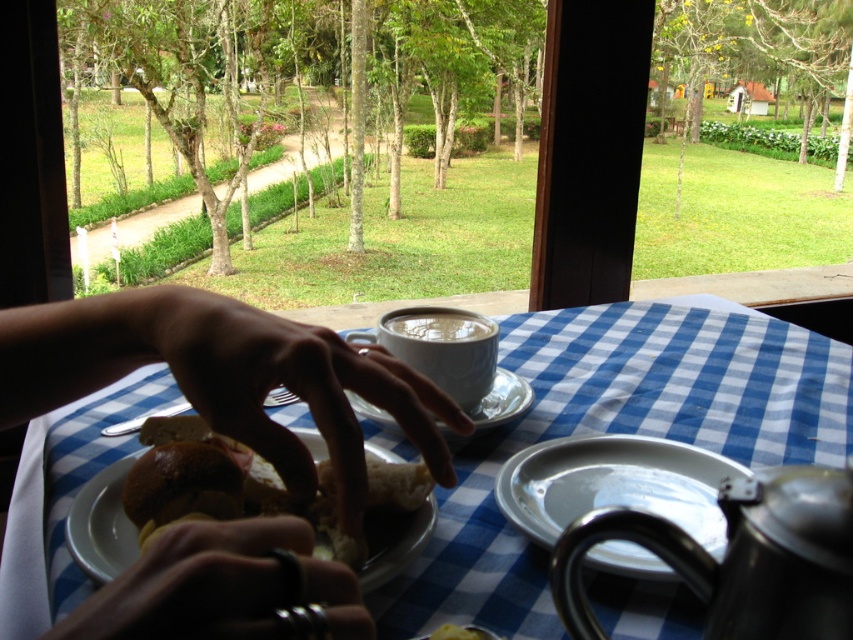
Is white glossy plate at center shorter than white ceramic plate at center?

Yes.

Is white glossy plate at center closer to the viewer compared to white ceramic plate at center?

No, it is not.

Which is behind, point (647, 472) or point (97, 512)?

The point (647, 472) is behind.

Where is `white glossy plate at center`? The width and height of the screenshot is (853, 640). white glossy plate at center is located at coordinates (614, 484).

What do you see at coordinates (296, 388) in the screenshot?
I see `matte skin hand at center` at bounding box center [296, 388].

Is matte skin hand at center below white ceramic plate at center?

Incorrect, matte skin hand at center is not positioned below white ceramic plate at center.

Find the location of a particular element. matte skin hand at center is located at coordinates (x=296, y=388).

Between matte skin hand at center and white ceramic cup at center, which one has less height?

With less height is white ceramic cup at center.

Does matte skin hand at center have a lesser width compared to white ceramic cup at center?

No.

Where is `matte skin hand at center`? This screenshot has height=640, width=853. matte skin hand at center is located at coordinates (296, 388).